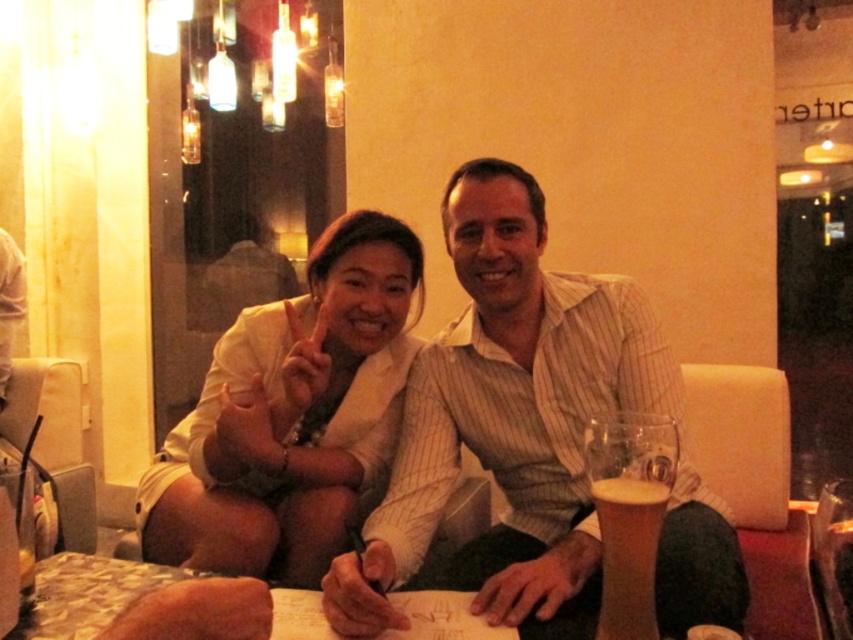
Question: Is the position of golden frothy beer at lower right less distant than that of foamy glass beer at lower right?

Choices:
 (A) no
 (B) yes

Answer: (B)

Question: Which point is closer to the camera?

Choices:
 (A) (225, 538)
 (B) (831, 592)

Answer: (B)

Question: Does white striped shirt at center appear on the left side of golden frothy beer at lower right?

Choices:
 (A) no
 (B) yes

Answer: (B)

Question: Which point is farther to the camera?

Choices:
 (A) (283, 484)
 (B) (525, 243)
 (C) (659, 515)

Answer: (A)

Question: Can you confirm if white striped shirt at center is thinner than golden frothy beer at lower right?

Choices:
 (A) yes
 (B) no

Answer: (B)

Question: Based on their relative distances, which object is farther from the foamy glass beer at lower right?

Choices:
 (A) golden frothy beer at lower right
 (B) white textured blouse at center

Answer: (B)